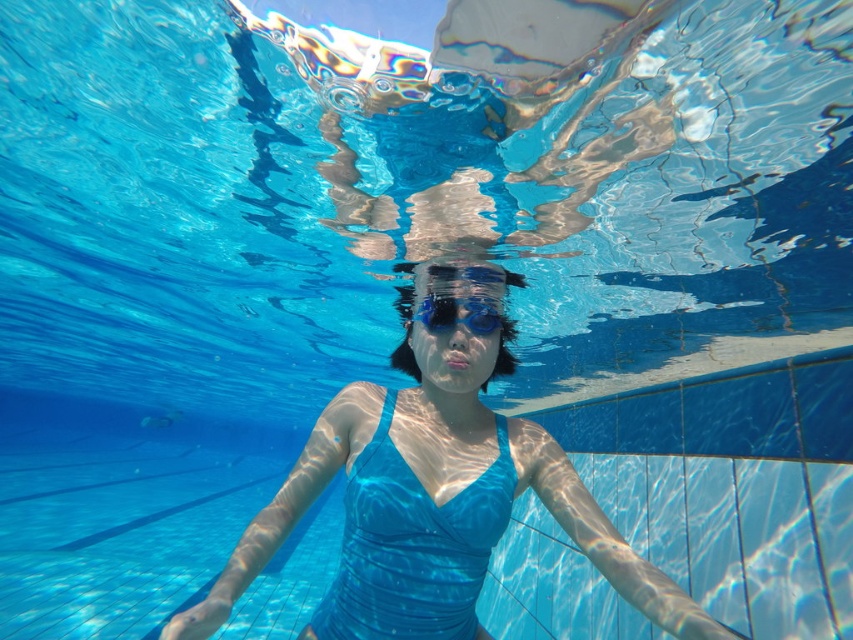
Question: Which object appears closest to the camera in this image?

Choices:
 (A) blue matte goggles at center
 (B) matte blue swimsuit at center
 (C) blue matte swimsuit at center

Answer: (C)

Question: Is matte blue swimsuit at center to the left of blue matte goggles at center from the viewer's perspective?

Choices:
 (A) yes
 (B) no

Answer: (A)

Question: Is the position of matte blue swimsuit at center less distant than that of blue matte goggles at center?

Choices:
 (A) no
 (B) yes

Answer: (B)

Question: Which is nearer to the matte blue swimsuit at center?

Choices:
 (A) blue matte goggles at center
 (B) blue matte swimsuit at center

Answer: (B)

Question: Is matte blue swimsuit at center smaller than blue matte goggles at center?

Choices:
 (A) no
 (B) yes

Answer: (A)

Question: Which of these objects is positioned closest to the blue matte swimsuit at center?

Choices:
 (A) matte blue swimsuit at center
 (B) blue matte goggles at center

Answer: (A)